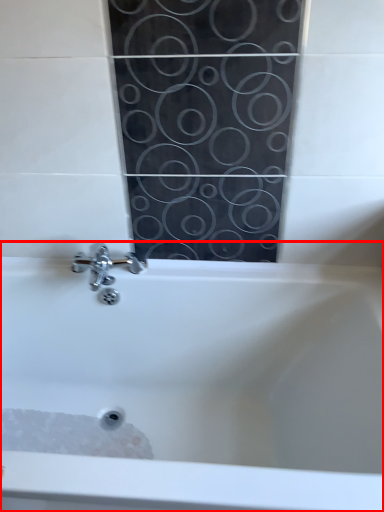
Question: From the image's perspective, considering the relative positions of bathtub (annotated by the red box) and foam in the image provided, where is bathtub (annotated by the red box) located with respect to the staircase?

Choices:
 (A) below
 (B) above

Answer: (B)